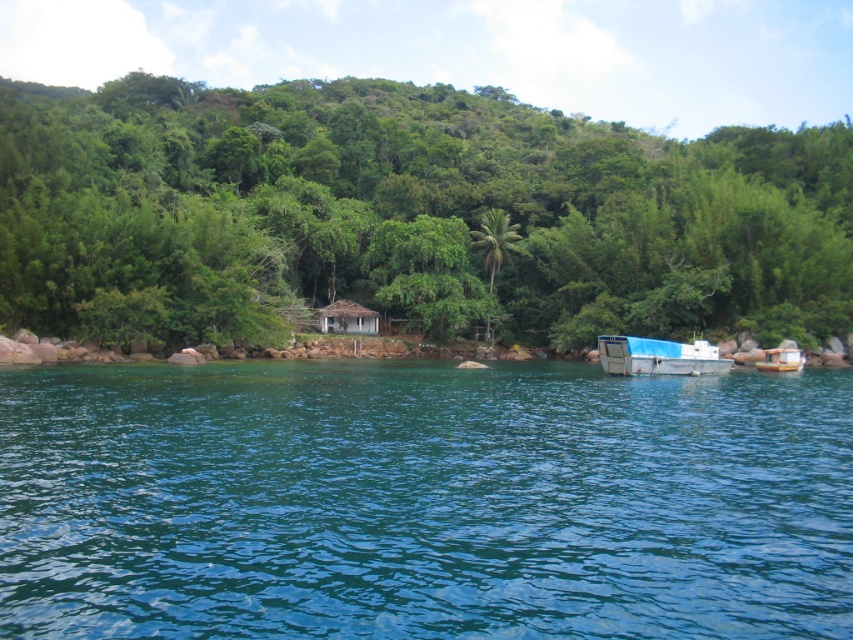
Between brown thatched hut at center and white plastic boat at lower right, which one is positioned lower?

white plastic boat at lower right is below.

Can you confirm if brown thatched hut at center is positioned below white plastic boat at lower right?

Actually, brown thatched hut at center is above white plastic boat at lower right.

This screenshot has height=640, width=853. I want to click on brown thatched hut at center, so click(x=347, y=317).

Identify the location of brown thatched hut at center. (347, 317).

Identify the location of green leafy tree at center. (405, 214).

Can you confirm if green leafy tree at center is smaller than white plastic boat at lower right?

Actually, green leafy tree at center might be larger than white plastic boat at lower right.

The width and height of the screenshot is (853, 640). In order to click on green leafy tree at center in this screenshot , I will do `click(405, 214)`.

What do you see at coordinates (422, 500) in the screenshot?
I see `clear blue water at center` at bounding box center [422, 500].

Locate an element on the screen. Image resolution: width=853 pixels, height=640 pixels. clear blue water at center is located at coordinates (422, 500).